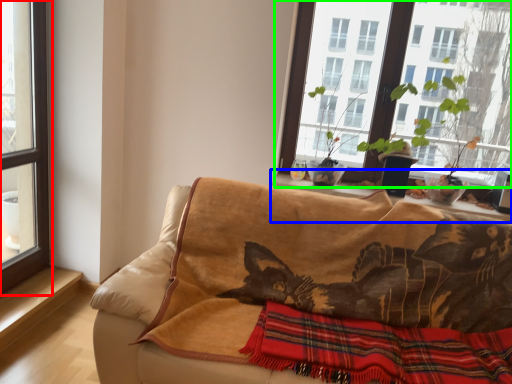
Question: Which is farther away from window (highlighted by a red box)? window sill (highlighted by a blue box) or window (highlighted by a green box)?

Choices:
 (A) window sill
 (B) window

Answer: (B)